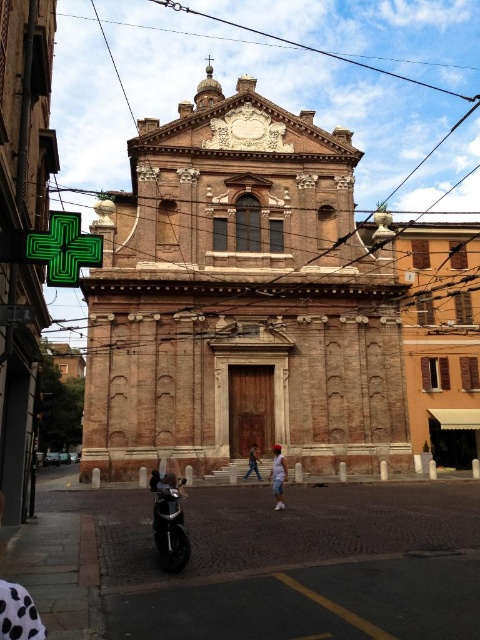
Is shiny black motorcycle at center further to the viewer compared to denim pants at center?

No, it is in front of denim pants at center.

Can you confirm if shiny black motorcycle at center is smaller than denim pants at center?

Actually, shiny black motorcycle at center might be larger than denim pants at center.

Which is in front, point (177, 568) or point (252, 456)?

Point (177, 568) is in front.

You are a GUI agent. You are given a task and a screenshot of the screen. Output one action in this format:
    pyautogui.click(x=<x>, y=<y>)
    Task: Click on the shiny black motorcycle at center
    The image size is (480, 640).
    Given the screenshot: What is the action you would take?
    pyautogui.click(x=168, y=522)

Who is higher up, light blue denim shorts at center or denim pants at center?

denim pants at center

Who is more forward, [280,464] or [256,474]?

Point [280,464] is in front.

Is point (280, 496) positioned before point (252, 464)?

That is True.

Find the location of a particular element. light blue denim shorts at center is located at coordinates (277, 476).

Who is shorter, brown brick church at center or denim pants at center?

With less height is denim pants at center.

Can you confirm if brown brick church at center is wider than denim pants at center?

Correct, the width of brown brick church at center exceeds that of denim pants at center.

You are a GUI agent. You are given a task and a screenshot of the screen. Output one action in this format:
    pyautogui.click(x=<x>, y=<y>)
    Task: Click on the brown brick church at center
    
    Given the screenshot: What is the action you would take?
    pyautogui.click(x=240, y=298)